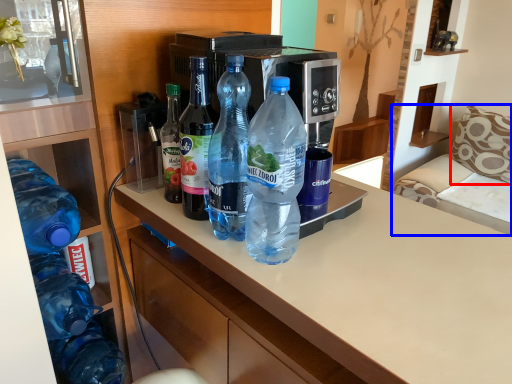
Question: Among these objects, which one is farthest to the camera, pillow (highlighted by a red box) or furniture (highlighted by a blue box)?

Choices:
 (A) pillow
 (B) furniture

Answer: (A)